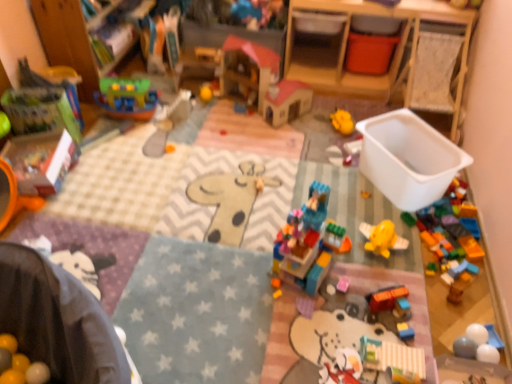
The image size is (512, 384). I want to click on vacant area that is in front of yellow rubber duck at center, acting as the 6th toy starting from the top, so click(332, 146).